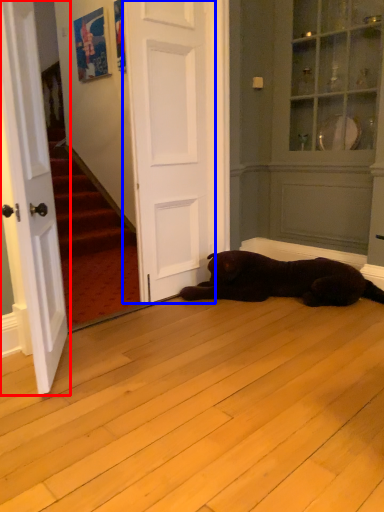
Question: Which point is further to the camera, door (highlighted by a red box) or door (highlighted by a blue box)?

Choices:
 (A) door
 (B) door

Answer: (B)